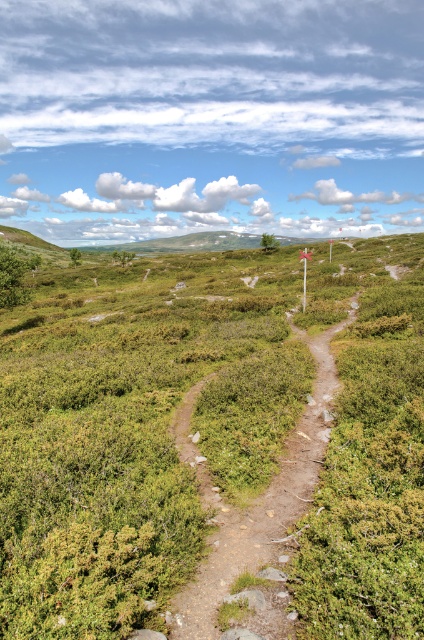
Question: Can you confirm if green leafy shrubs at center is positioned above dirt path at center?

Choices:
 (A) no
 (B) yes

Answer: (B)

Question: Among these points, which one is nearest to the camera?

Choices:
 (A) (407, 285)
 (B) (195, 605)

Answer: (B)

Question: Can you confirm if green leafy shrubs at center is bigger than dirt path at center?

Choices:
 (A) no
 (B) yes

Answer: (B)

Question: In this image, where is green leafy shrubs at center located relative to dirt path at center?

Choices:
 (A) right
 (B) left

Answer: (A)